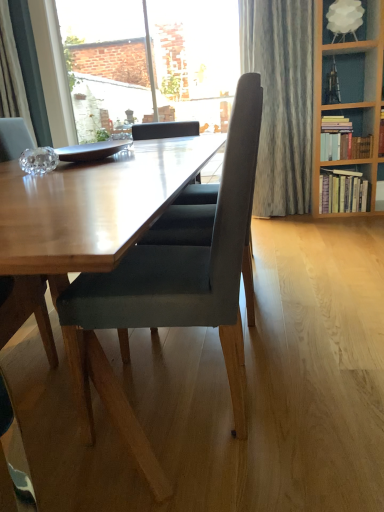
Where is `free spot in front of velvet grey chair at center`? This screenshot has height=512, width=384. free spot in front of velvet grey chair at center is located at coordinates (195, 477).